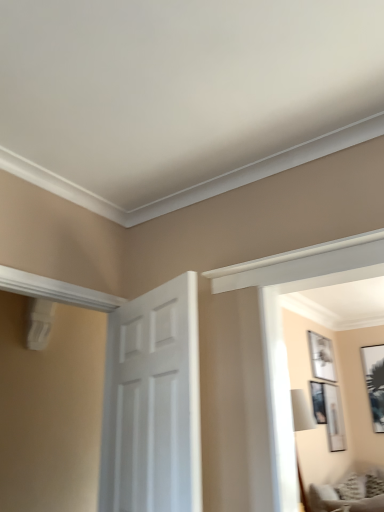
Question: From a real-world perspective, is matte black picture frame at upper right, which is counted as the fourth picture frame, starting from the right, on top of black glossy picture frame at upper right, which appears as the 1th picture frame when viewed from the right?

Choices:
 (A) yes
 (B) no

Answer: (B)

Question: Can you confirm if matte black picture frame at upper right, which is counted as the fourth picture frame, starting from the right, is taller than black glossy picture frame at upper right, the 4th picture frame when ordered from left to right?

Choices:
 (A) yes
 (B) no

Answer: (B)

Question: Is matte black picture frame at upper right, acting as the 1th picture frame starting from the left, not inside black glossy picture frame at upper right, which appears as the 1th picture frame when viewed from the right?

Choices:
 (A) no
 (B) yes

Answer: (B)

Question: Is black glossy picture frame at upper right, the 4th picture frame when ordered from left to right, at the back of matte black picture frame at upper right, acting as the 1th picture frame starting from the left?

Choices:
 (A) no
 (B) yes

Answer: (A)

Question: Considering the relative sizes of matte black picture frame at upper right, which is counted as the fourth picture frame, starting from the right, and black glossy picture frame at upper right, the 4th picture frame when ordered from left to right, in the image provided, is matte black picture frame at upper right, which is counted as the fourth picture frame, starting from the right, smaller than black glossy picture frame at upper right, the 4th picture frame when ordered from left to right,?

Choices:
 (A) no
 (B) yes

Answer: (B)

Question: From the image's perspective, is matte black picture frame at upper right, which is counted as the fourth picture frame, starting from the right, beneath black glossy picture frame at upper right, the 4th picture frame when ordered from left to right?

Choices:
 (A) yes
 (B) no

Answer: (B)

Question: From the image's perspective, does black glossy picture frame at upper right, which appears as the 1th picture frame when viewed from the right, appear lower than matte black picture frame at upper right, which is counted as the fourth picture frame, starting from the right?

Choices:
 (A) yes
 (B) no

Answer: (A)

Question: From the image's perspective, is black glossy picture frame at upper right, which appears as the 1th picture frame when viewed from the right, on top of matte black picture frame at upper right, acting as the 1th picture frame starting from the left?

Choices:
 (A) no
 (B) yes

Answer: (A)

Question: Can you confirm if black glossy picture frame at upper right, the 4th picture frame when ordered from left to right, is thinner than matte black picture frame at upper right, acting as the 1th picture frame starting from the left?

Choices:
 (A) no
 (B) yes

Answer: (A)

Question: Is black glossy picture frame at upper right, the 4th picture frame when ordered from left to right, smaller than matte black picture frame at upper right, which is counted as the fourth picture frame, starting from the right?

Choices:
 (A) yes
 (B) no

Answer: (B)

Question: Does black glossy picture frame at upper right, the 4th picture frame when ordered from left to right, have a larger size compared to matte black picture frame at upper right, acting as the 1th picture frame starting from the left?

Choices:
 (A) yes
 (B) no

Answer: (A)

Question: Is the position of black glossy picture frame at upper right, the 4th picture frame when ordered from left to right, less distant than that of matte black picture frame at upper right, acting as the 1th picture frame starting from the left?

Choices:
 (A) no
 (B) yes

Answer: (A)

Question: From the image's perspective, is matte black picture frame at upper right, the 3th picture frame viewed from the left, below black glossy picture frame at upper right, the 4th picture frame when ordered from left to right?

Choices:
 (A) no
 (B) yes

Answer: (B)